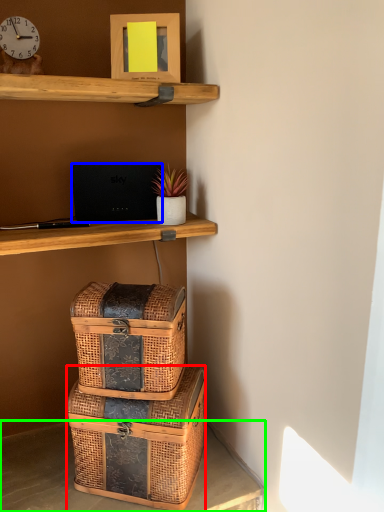
Question: Which object is positioned closest to box (highlighted by a red box)? Select from laptop (highlighted by a blue box) and desk (highlighted by a green box).

Choices:
 (A) laptop
 (B) desk

Answer: (B)